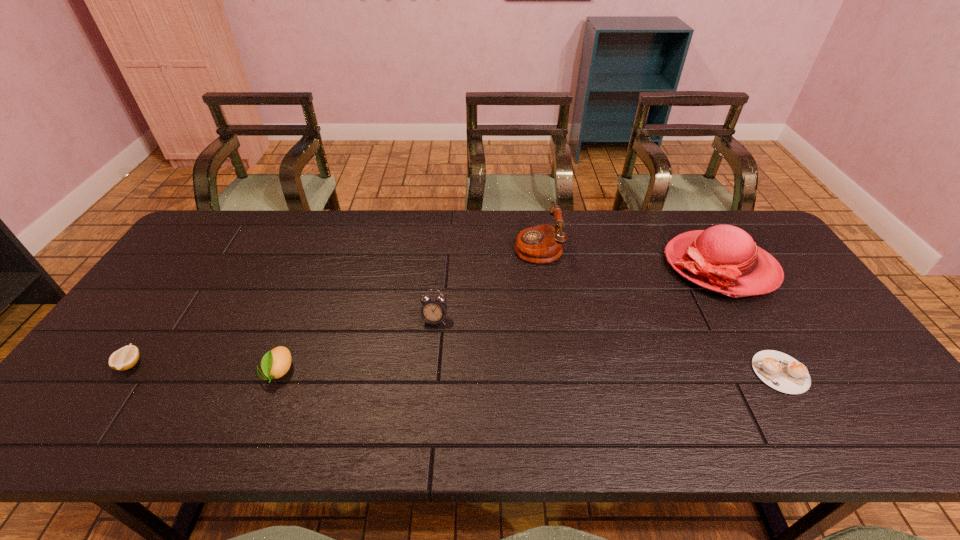
You are a GUI agent. You are given a task and a screenshot of the screen. Output one action in this format:
    pyautogui.click(x=<x>, y=<y>)
    Task: Click on the free space located 0.260m on the dial of the third object from right to left
    Image resolution: width=960 pixels, height=540 pixels.
    Given the screenshot: What is the action you would take?
    (x=434, y=246)

Identify the location of vacant region located on the dial of the third object from right to left. The width and height of the screenshot is (960, 540). (458, 246).

Image resolution: width=960 pixels, height=540 pixels. I want to click on free space located at the front of the hat with a bow, so point(604,266).

This screenshot has height=540, width=960. I want to click on blank space located 0.380m at the front of the hat with a bow, so click(x=542, y=266).

I want to click on vacant space located at the front of the hat with a bow, so (x=627, y=266).

The width and height of the screenshot is (960, 540). I want to click on free space located on the face of the fourth object from right to left, so click(x=423, y=434).

Find the location of a particular element. This screenshot has width=960, height=540. vacant region located 0.070m with leaves positioned above the fifth object from right to left is located at coordinates (260, 417).

The width and height of the screenshot is (960, 540). In order to click on free space located on the right of the shorter lemon in this screenshot , I will do `click(219, 364)`.

Identify the location of blank area located 0.090m on the left of the shortest object. (717, 372).

The height and width of the screenshot is (540, 960). Identify the location of telephone situated at the far edge. (541, 244).